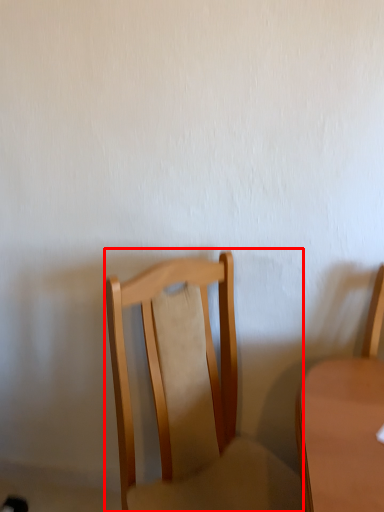
Question: From the image's perspective, considering the relative positions of chair (annotated by the red box) and chair in the image provided, where is chair (annotated by the red box) located with respect to the staircase?

Choices:
 (A) below
 (B) above

Answer: (A)